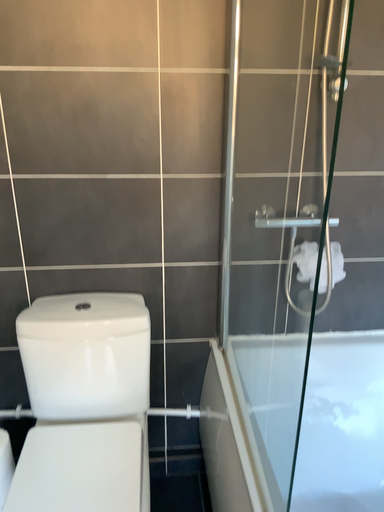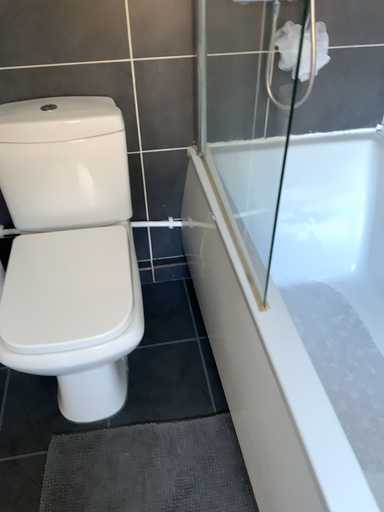
Question: How did the camera likely rotate when shooting the video?

Choices:
 (A) rotated upward
 (B) rotated downward

Answer: (B)